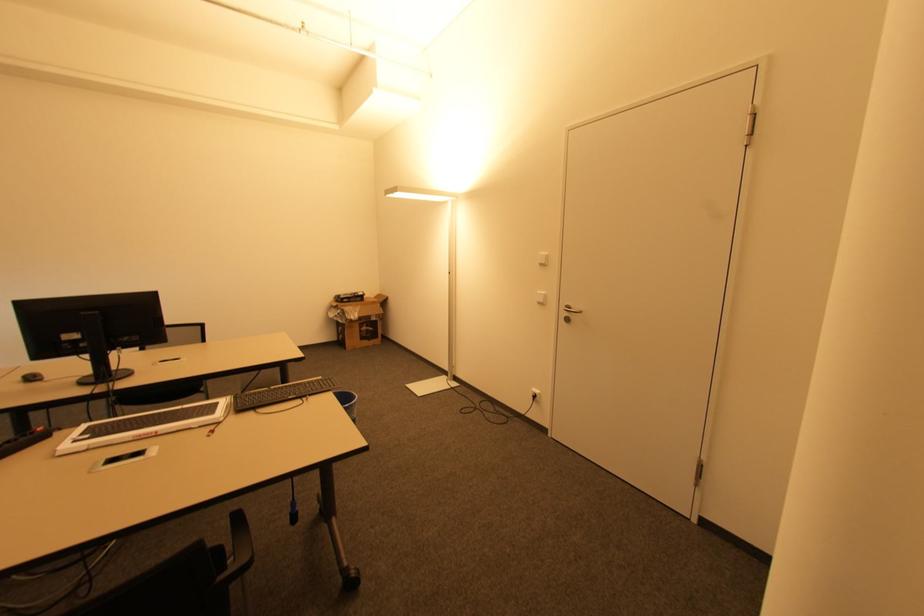
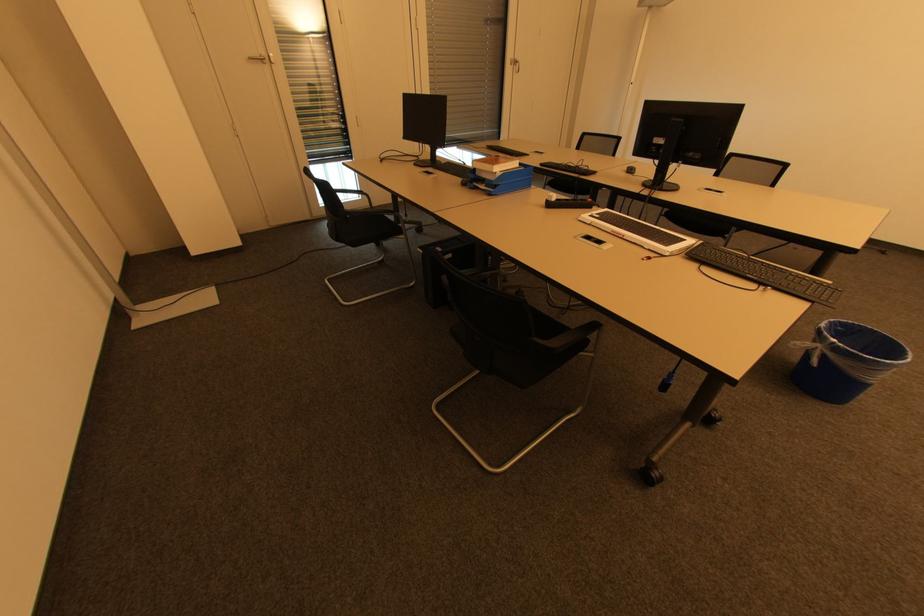
Locate, in the second image, the point that corresponds to (x=105, y=376) in the first image.

(660, 183)